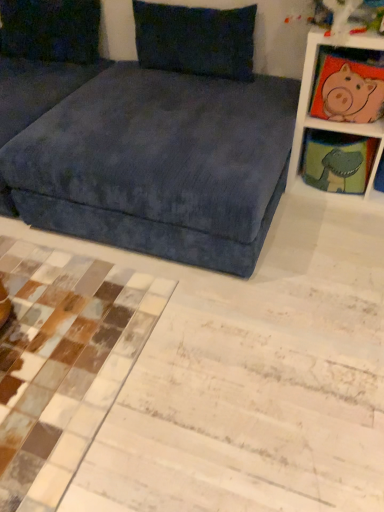
Image resolution: width=384 pixels, height=512 pixels. In order to click on vacant point above pink fabric pig at upper right (from a real-world perspective) in this screenshot , I will do (x=354, y=51).